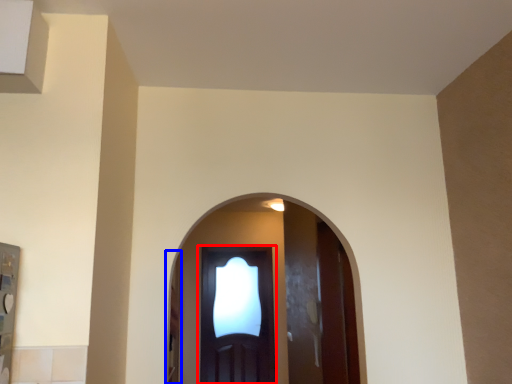
Question: Which of the following is the farthest to the observer, door (highlighted by a red box) or screen door (highlighted by a blue box)?

Choices:
 (A) door
 (B) screen door

Answer: (A)